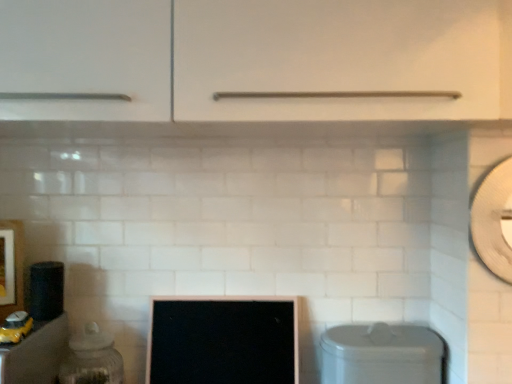
Question: Is matte black cabinet at lower left, which ranks as the second cabinetry in front-to-back order, positioned behind black glossy computer monitor at center?

Choices:
 (A) yes
 (B) no

Answer: (B)

Question: Can you confirm if matte black cabinet at lower left, placed as the second cabinetry when sorted from right to left, is smaller than black glossy computer monitor at center?

Choices:
 (A) no
 (B) yes

Answer: (A)

Question: From a real-world perspective, is matte black cabinet at lower left, acting as the first cabinetry starting from the bottom, under black glossy computer monitor at center?

Choices:
 (A) no
 (B) yes

Answer: (B)

Question: Would you say matte black cabinet at lower left, acting as the first cabinetry starting from the left, is outside black glossy computer monitor at center?

Choices:
 (A) yes
 (B) no

Answer: (A)

Question: Can you confirm if matte black cabinet at lower left, acting as the first cabinetry starting from the bottom, is thinner than black glossy computer monitor at center?

Choices:
 (A) yes
 (B) no

Answer: (B)

Question: Is matte black cabinet at lower left, which is counted as the 1th cabinetry, starting from the back, touching black glossy computer monitor at center?

Choices:
 (A) yes
 (B) no

Answer: (B)

Question: Considering the relative sizes of black glossy computer monitor at center and white matte cabinet handle at center, placed as the first cabinetry when sorted from front to back, in the image provided, is black glossy computer monitor at center bigger than white matte cabinet handle at center, placed as the first cabinetry when sorted from front to back,?

Choices:
 (A) no
 (B) yes

Answer: (A)

Question: Does black glossy computer monitor at center have a lesser height compared to white matte cabinet handle at center, the 2th cabinetry positioned from the bottom?

Choices:
 (A) no
 (B) yes

Answer: (A)

Question: From a real-world perspective, is black glossy computer monitor at center on top of white matte cabinet handle at center, the 2th cabinetry positioned from the bottom?

Choices:
 (A) yes
 (B) no

Answer: (B)

Question: Is black glossy computer monitor at center next to white matte cabinet handle at center, the first cabinetry from the right?

Choices:
 (A) no
 (B) yes

Answer: (A)

Question: Is black glossy computer monitor at center behind white matte cabinet handle at center, the 2th cabinetry from the back?

Choices:
 (A) no
 (B) yes

Answer: (B)

Question: Is black glossy computer monitor at center positioned far away from white matte cabinet handle at center, the first cabinetry from the right?

Choices:
 (A) no
 (B) yes

Answer: (A)

Question: Can you confirm if clear glass jar at left, which is the first appliance from bottom to top, is smaller than wooden framed picture at left?

Choices:
 (A) yes
 (B) no

Answer: (B)